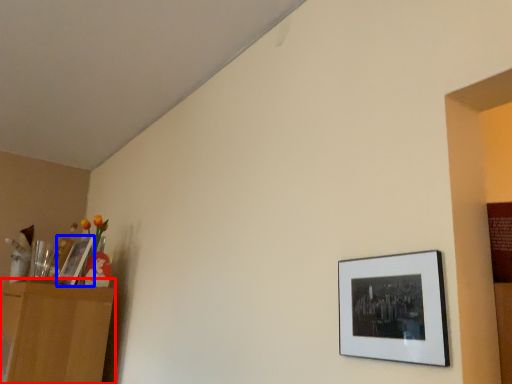
Question: Which point is further to the camera, dresser (highlighted by a red box) or picture frame (highlighted by a blue box)?

Choices:
 (A) dresser
 (B) picture frame

Answer: (B)